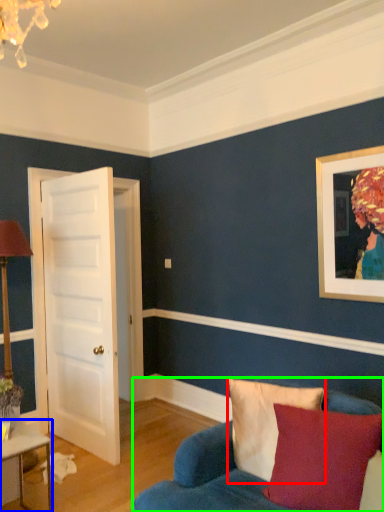
Question: Which object is positioned closest to pillow (highlighted by a red box)? Select from table (highlighted by a blue box) and studio couch (highlighted by a green box).

Choices:
 (A) table
 (B) studio couch

Answer: (B)